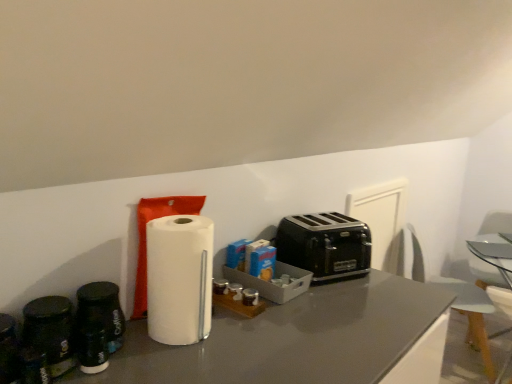
Question: From the image's perspective, is clear glass table at center positioned above or below white matte paper towel at center?

Choices:
 (A) above
 (B) below

Answer: (B)

Question: Considering the positions of point (507, 256) and point (189, 256), is point (507, 256) closer or farther from the camera than point (189, 256)?

Choices:
 (A) farther
 (B) closer

Answer: (A)

Question: Estimate the real-world distances between objects in this image. Which object is closer to the black metallic toaster at center?

Choices:
 (A) white plastic swivel chair at right, which appears as the first swivel chair when viewed from the right
 (B) black matte coffee canister at left
 (C) clear glass table at center
 (D) white plastic swivel chair at right, which is counted as the 1th swivel chair, starting from the left
 (E) white matte paper towel at center

Answer: (E)

Question: Estimate the real-world distances between objects in this image. Which object is closer to the white matte paper towel at center?

Choices:
 (A) white plastic swivel chair at right, the 2th swivel chair positioned from the right
 (B) clear glass table at center
 (C) white plastic swivel chair at right, which appears as the first swivel chair when viewed from the right
 (D) black metallic toaster at center
 (E) black matte coffee canister at left

Answer: (E)